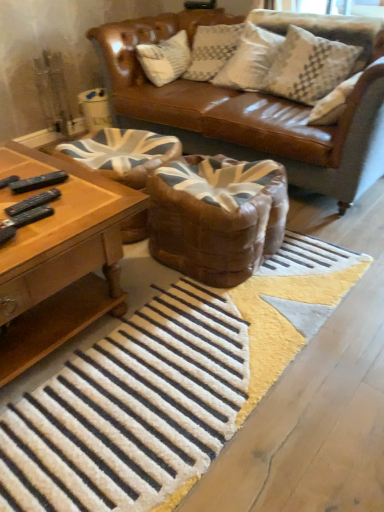
Question: From a real-world perspective, is white textured pillow at upper right above or below woodenobject at left?

Choices:
 (A) below
 (B) above

Answer: (B)

Question: Considering the positions of white textured pillow at upper right and woodenobject at left in the image, is white textured pillow at upper right taller or shorter than woodenobject at left?

Choices:
 (A) short
 (B) tall

Answer: (B)

Question: Estimate the real-world distances between objects in this image. Which object is farther from the white textured rug at center?

Choices:
 (A) woodenobject at left
 (B) brown woven swivel chair at center, positioned as the second swivel chair in right-to-left order
 (C) brown leather swivel chair at center, the second swivel chair in the left-to-right sequence
 (D) white textured pillow at upper right

Answer: (D)

Question: Estimate the real-world distances between objects in this image. Which object is farther from the brown woven swivel chair at center, which is the first swivel chair from left to right?

Choices:
 (A) brown leather swivel chair at center, which ranks as the 1th swivel chair in right-to-left order
 (B) white textured rug at center
 (C) woodenobject at left
 (D) white textured pillow at upper right

Answer: (D)